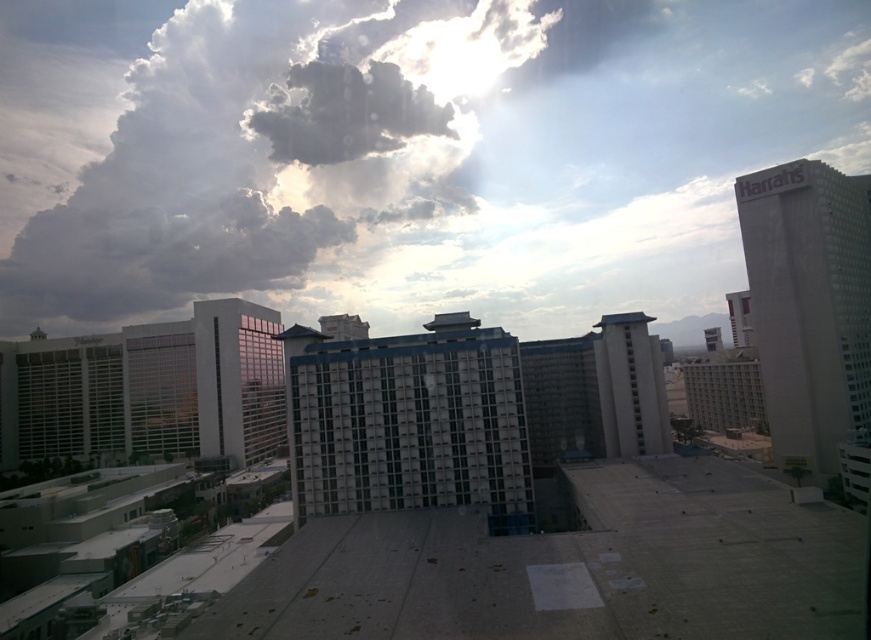
You are an architect designing a new building and want to ensure it doesn not block the view of the white fluffy cloud at upper center from the white glass building at left. Given their sizes, which object should be placed closer to the viewer to maintain the view?

The white fluffy cloud at upper center is larger in width than the white glass building at left. To maintain the view of the white fluffy cloud at upper center from the white glass building at left, the white glass building at left should be placed closer to the viewer. This way, the larger cloud will remain visible above the building.

You are standing at the camera position looking at the point labeled point (196, 316). Is it far away or close to you?

The point labeled point (196, 316) is 590.35 feet away from you, so it is far away.

You are standing on the rooftop and looking at the white glass building at left and the white textured building at center. Which building is closer to you?

The white glass building at left is closer to you because it is positioned below the white textured building at center, indicating it is nearer in the scene.